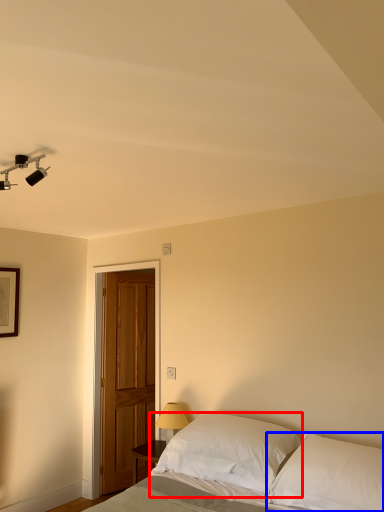
Question: Which point is further to the camera, pillow (highlighted by a red box) or pillow (highlighted by a blue box)?

Choices:
 (A) pillow
 (B) pillow

Answer: (A)